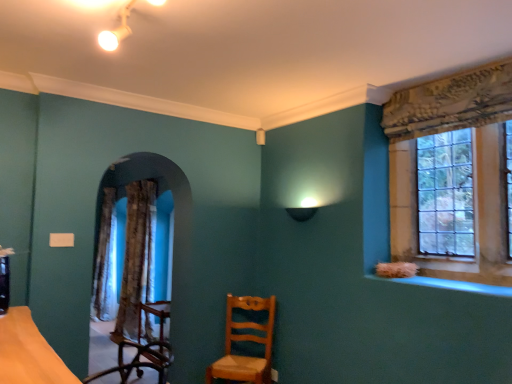
Question: In the image, is textured brown curtain at left positioned in front of or behind clear glass window at upper right?

Choices:
 (A) front
 (B) behind

Answer: (B)

Question: Considering the positions of textured brown curtain at left and clear glass window at upper right in the image, is textured brown curtain at left wider or thinner than clear glass window at upper right?

Choices:
 (A) thin
 (B) wide

Answer: (B)

Question: Considering the real-world distances, which object is closest to the textured brown curtain at left?

Choices:
 (A) light brown wood chair at center
 (B) clear glass window at upper right
 (C) blue glossy window sill at lower right

Answer: (A)

Question: Considering the real-world distances, which object is farthest from the textured brown curtain at left?

Choices:
 (A) blue glossy window sill at lower right
 (B) clear glass window at upper right
 (C) light brown wood chair at center

Answer: (B)